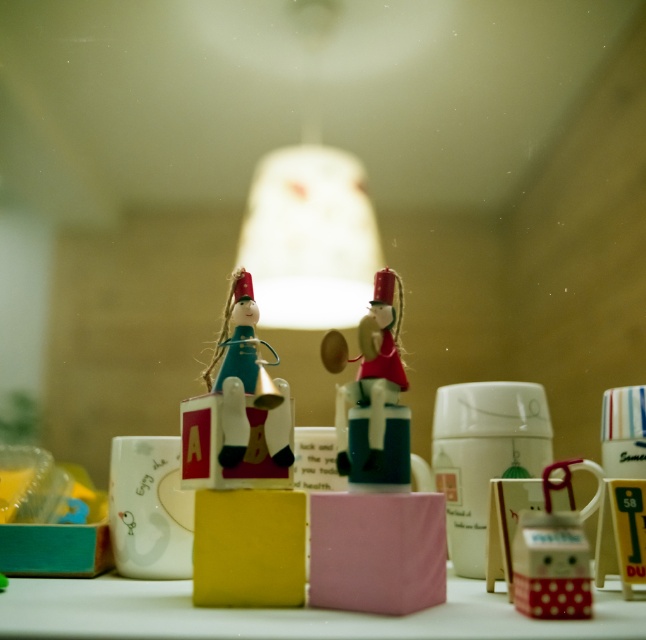
Question: Which point is farther to the camera?

Choices:
 (A) (216, 541)
 (B) (404, 621)

Answer: (A)

Question: Estimate the real-world distances between objects in this image. Which object is farther from the wooden toy at center?

Choices:
 (A) wooden figure at center
 (B) white matte table at center

Answer: (B)

Question: Is wooden figure at center wider than white matte table at center?

Choices:
 (A) yes
 (B) no

Answer: (B)

Question: Is wooden figure at center thinner than white matte table at center?

Choices:
 (A) no
 (B) yes

Answer: (B)

Question: Which object is the closest to the wooden figure at center?

Choices:
 (A) white matte table at center
 (B) wooden toy at center

Answer: (B)

Question: Can you confirm if white matte table at center is positioned above wooden toy at center?

Choices:
 (A) no
 (B) yes

Answer: (A)